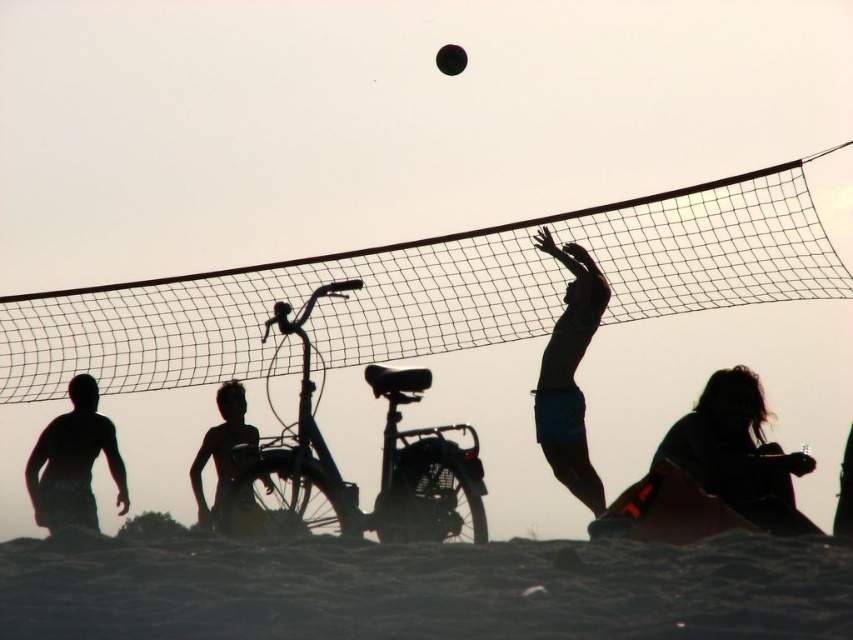
Can you confirm if silhouette shorts at lower left is positioned to the left of silhouette skin at center?

Correct, you'll find silhouette shorts at lower left to the left of silhouette skin at center.

Is silhouette shorts at lower left positioned in front of silhouette skin at center?

That is False.

The width and height of the screenshot is (853, 640). I want to click on silhouette shorts at lower left, so click(x=73, y=461).

Image resolution: width=853 pixels, height=640 pixels. What are the coordinates of `silhouette shorts at lower left` in the screenshot? It's located at tap(73, 461).

Measure the distance between blue matte shorts at center and silhouette skin at center.

blue matte shorts at center and silhouette skin at center are 12.41 meters apart from each other.

Between blue matte shorts at center and silhouette skin at center, which one appears on the right side from the viewer's perspective?

blue matte shorts at center is more to the right.

Between point (572, 433) and point (236, 384), which one is positioned in front?

Point (572, 433) is more forward.

Locate an element on the screen. blue matte shorts at center is located at coordinates (569, 374).

Is dark hair at lower right positioned in front of silhouette skin at center?

Yes, dark hair at lower right is in front of silhouette skin at center.

Between dark hair at lower right and silhouette skin at center, which one is positioned higher?

dark hair at lower right is higher up.

Is point (688, 419) farther from viewer compared to point (251, 461)?

Yes, point (688, 419) is behind point (251, 461).

This screenshot has width=853, height=640. I want to click on dark hair at lower right, so click(x=738, y=452).